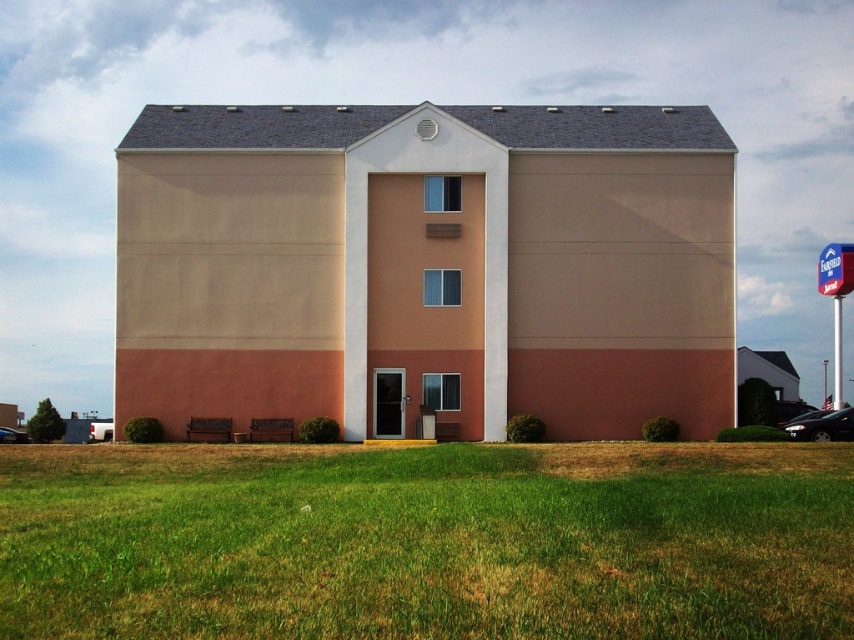
Is green grass at lower center above black glossy car at lower right?

Yes.

Is green grass at lower center wider than black glossy car at lower right?

Yes, green grass at lower center is wider than black glossy car at lower right.

This screenshot has height=640, width=854. Find the location of `green grass at lower center`. green grass at lower center is located at coordinates (427, 540).

Is green grass at lower center bigger than metallic silver car at lower left?

Indeed, green grass at lower center has a larger size compared to metallic silver car at lower left.

Can you confirm if green grass at lower center is positioned above metallic silver car at lower left?

Yes, green grass at lower center is above metallic silver car at lower left.

Who is more distant from viewer, (483, 538) or (3, 433)?

Point (3, 433)

I want to click on green grass at lower center, so click(427, 540).

Which of these two, black glossy car at lower right or metallic silver car at lower left, stands shorter?

black glossy car at lower right is shorter.

Does black glossy car at lower right have a greater width compared to metallic silver car at lower left?

Incorrect, black glossy car at lower right's width does not surpass metallic silver car at lower left's.

Between point (839, 412) and point (15, 442), which one is positioned in front?

Point (839, 412) is more forward.

Image resolution: width=854 pixels, height=640 pixels. What are the coordinates of `black glossy car at lower right` in the screenshot? It's located at (823, 426).